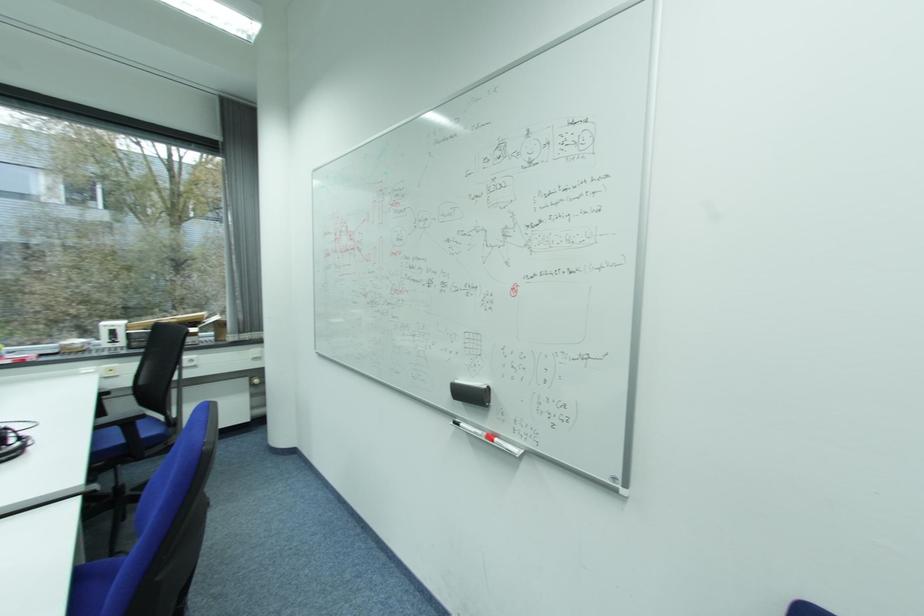
Identify the location of black chair sitting surface. This screenshot has height=616, width=924. (153, 463).